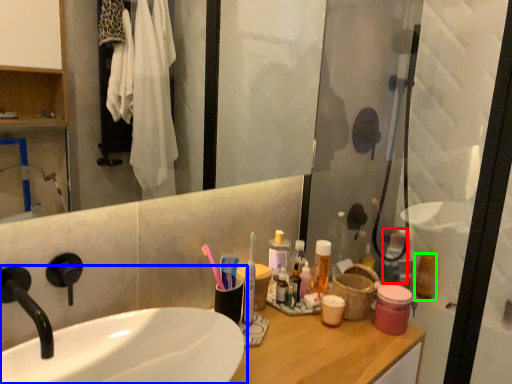
Question: Considering the real-world distances, which object is farthest from mouthwash (highlighted by a red box)? sink (highlighted by a blue box) or mouthwash (highlighted by a green box)?

Choices:
 (A) sink
 (B) mouthwash

Answer: (A)